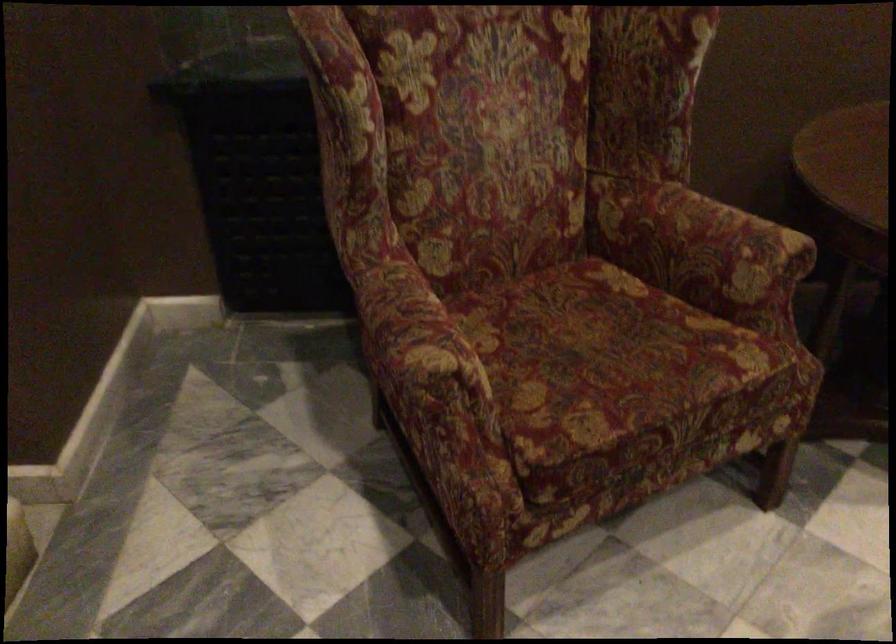
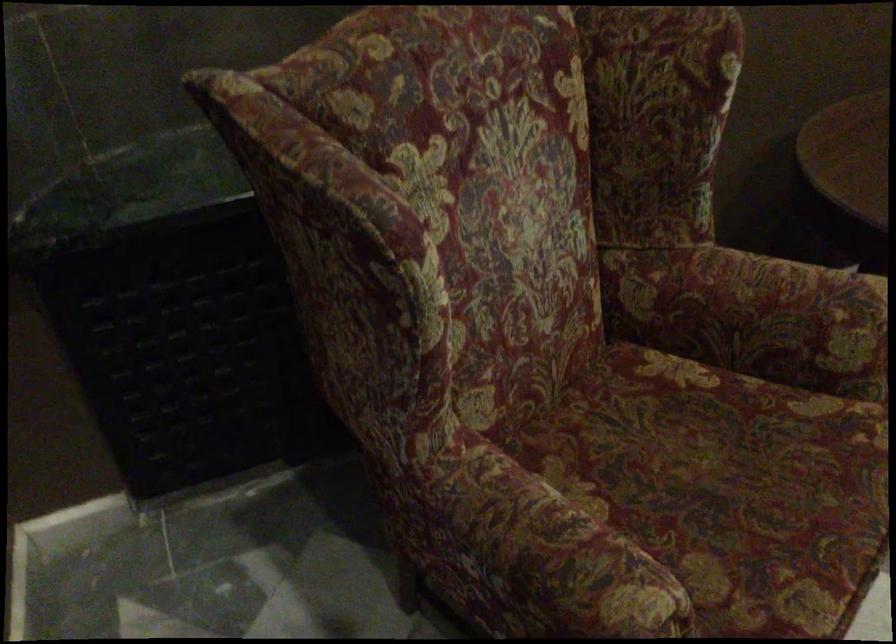
Find the pixel in the second image that matches (393,327) in the first image.

(543, 559)